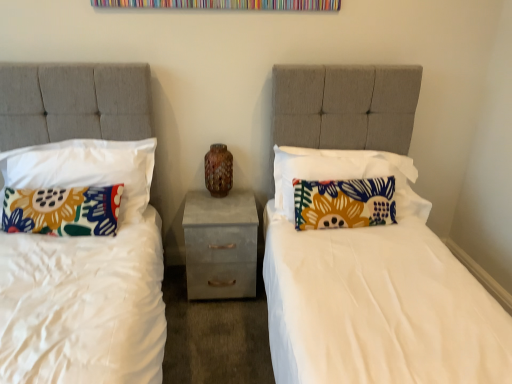
Question: Is concrete textured nightstand at center taller than floral fabric pillow at right, which is counted as the 2th pillow, starting from the right?

Choices:
 (A) yes
 (B) no

Answer: (A)

Question: Does concrete textured nightstand at center lie behind floral fabric pillow at right, which is counted as the 2th pillow, starting from the right?

Choices:
 (A) no
 (B) yes

Answer: (B)

Question: Is concrete textured nightstand at center at the right side of floral fabric pillow at right, which is counted as the 3th pillow, starting from the left?

Choices:
 (A) yes
 (B) no

Answer: (B)

Question: Is floral fabric pillow at right, which is counted as the 2th pillow, starting from the right, at the back of concrete textured nightstand at center?

Choices:
 (A) no
 (B) yes

Answer: (A)

Question: From the image's perspective, does concrete textured nightstand at center appear lower than floral fabric pillow at right, which is counted as the 3th pillow, starting from the left?

Choices:
 (A) no
 (B) yes

Answer: (B)

Question: From the image's perspective, is concrete textured nightstand at center positioned above or below brown speckled vase at center?

Choices:
 (A) above
 (B) below

Answer: (B)

Question: In the image, is concrete textured nightstand at center on the left side or the right side of brown speckled vase at center?

Choices:
 (A) right
 (B) left

Answer: (A)

Question: From a real-world perspective, is concrete textured nightstand at center positioned above or below brown speckled vase at center?

Choices:
 (A) above
 (B) below

Answer: (B)

Question: Considering their positions, is concrete textured nightstand at center located in front of or behind brown speckled vase at center?

Choices:
 (A) front
 (B) behind

Answer: (A)

Question: From a real-world perspective, relative to floral fabric pillow at right, which appears as the 1th pillow when viewed from the right, is floral fabric pillow at left, the second pillow viewed from the left, vertically above or below?

Choices:
 (A) above
 (B) below

Answer: (A)

Question: Based on their positions, is floral fabric pillow at left, the second pillow viewed from the left, located to the left or right of floral fabric pillow at right, the fourth pillow in the left-to-right sequence?

Choices:
 (A) left
 (B) right

Answer: (A)

Question: Relative to floral fabric pillow at right, which appears as the 1th pillow when viewed from the right, is floral fabric pillow at left, the second pillow viewed from the left, in front or behind?

Choices:
 (A) behind
 (B) front

Answer: (B)

Question: In terms of height, does floral fabric pillow at left, which is the 3th pillow from right to left, look taller or shorter compared to floral fabric pillow at right, the fourth pillow in the left-to-right sequence?

Choices:
 (A) short
 (B) tall

Answer: (B)

Question: From a real-world perspective, is floral fabric pillow at right, the fourth pillow in the left-to-right sequence, physically located above or below floral fabric pillow at left, which is the 4th pillow in right-to-left order?

Choices:
 (A) below
 (B) above

Answer: (B)

Question: In the image, is floral fabric pillow at right, which appears as the 1th pillow when viewed from the right, positioned in front of or behind floral fabric pillow at left, the 1th pillow viewed from the left?

Choices:
 (A) behind
 (B) front

Answer: (A)